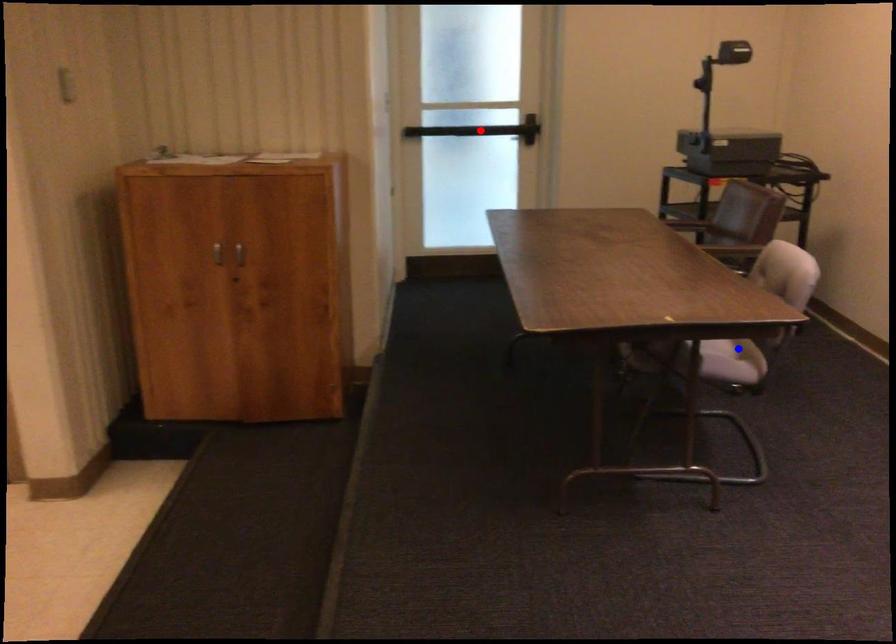
Question: Which of the two points in the image is closer to the camera?

Choices:
 (A) Blue point is closer.
 (B) Red point is closer.

Answer: (A)